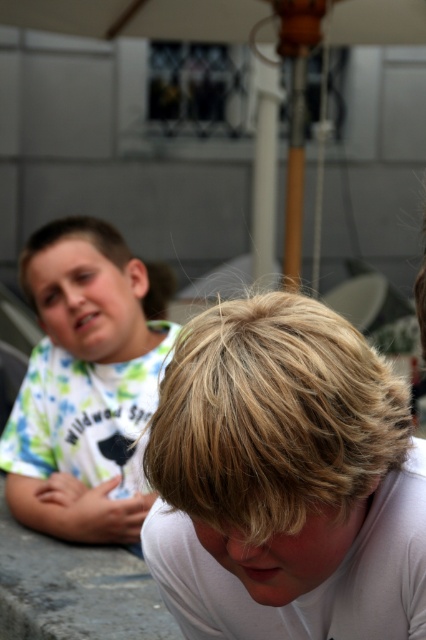
Question: Does blonde hair at lower center have a larger size compared to light green t-shirt at left?

Choices:
 (A) no
 (B) yes

Answer: (A)

Question: Can you confirm if blonde hair at lower center is positioned below light green t-shirt at left?

Choices:
 (A) yes
 (B) no

Answer: (A)

Question: Which point is farther from the camera taking this photo?

Choices:
 (A) (109, 244)
 (B) (298, 508)

Answer: (A)

Question: Where is blonde hair at lower center located in relation to light green t-shirt at left in the image?

Choices:
 (A) right
 (B) left

Answer: (A)